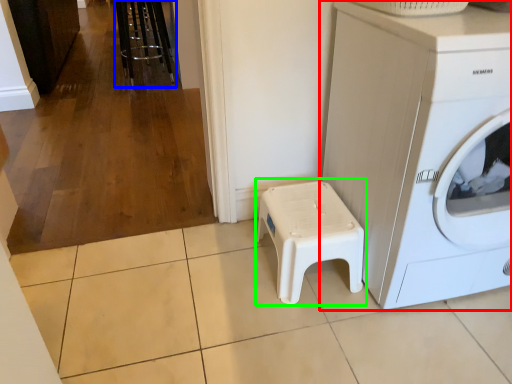
Question: Based on their relative distances, which object is nearer to washing machine (highlighted by a red box)? Choose from bar stool (highlighted by a blue box) and music stool (highlighted by a green box).

Choices:
 (A) bar stool
 (B) music stool

Answer: (B)